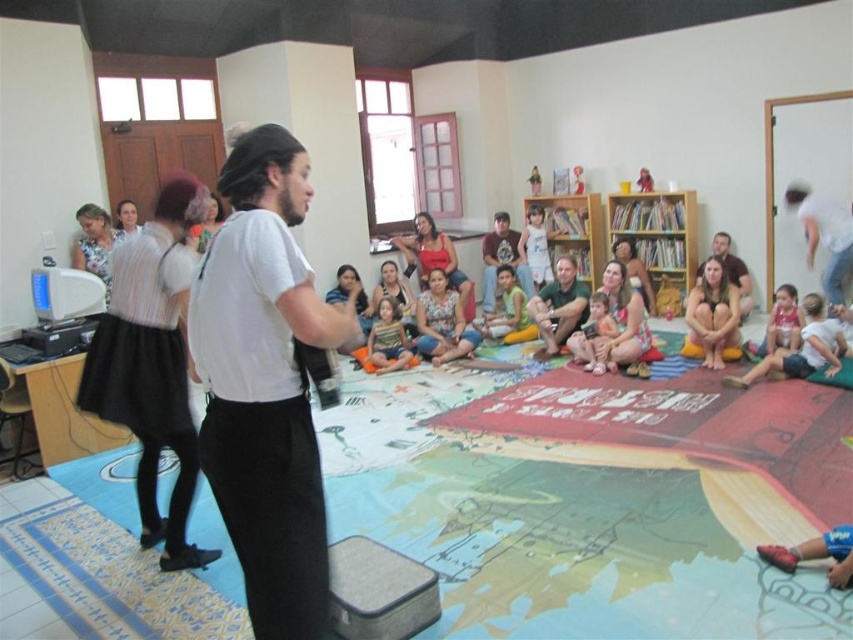
Measure the distance from white cotton shirt at upper right to pink fabric at center.

The distance of white cotton shirt at upper right from pink fabric at center is 2.26 meters.

Does white cotton shirt at upper right have a larger size compared to pink fabric at center?

Yes.

Where is `white cotton shirt at upper right`? This screenshot has width=853, height=640. white cotton shirt at upper right is located at coordinates (824, 237).

Which is more to the left, striped fabric shirt at center or matte red shirt at lower right?

Positioned to the left is striped fabric shirt at center.

Does striped fabric shirt at center have a lesser height compared to matte red shirt at lower right?

Incorrect, striped fabric shirt at center's height does not fall short of matte red shirt at lower right's.

Measure the distance between striped fabric shirt at center and camera.

striped fabric shirt at center and camera are 19.48 feet apart from each other.

Find the location of a particular element. Image resolution: width=853 pixels, height=640 pixels. striped fabric shirt at center is located at coordinates (387, 339).

Which is below, white cotton shirt at upper right or matte green shirt at center?

Positioned lower is matte green shirt at center.

Is white cotton shirt at upper right wider than matte green shirt at center?

No.

Consider the image. Who is more forward, (830, 253) or (579, 300)?

Point (579, 300) is more forward.

Find the location of `white cotton shirt at upper right`. white cotton shirt at upper right is located at coordinates (824, 237).